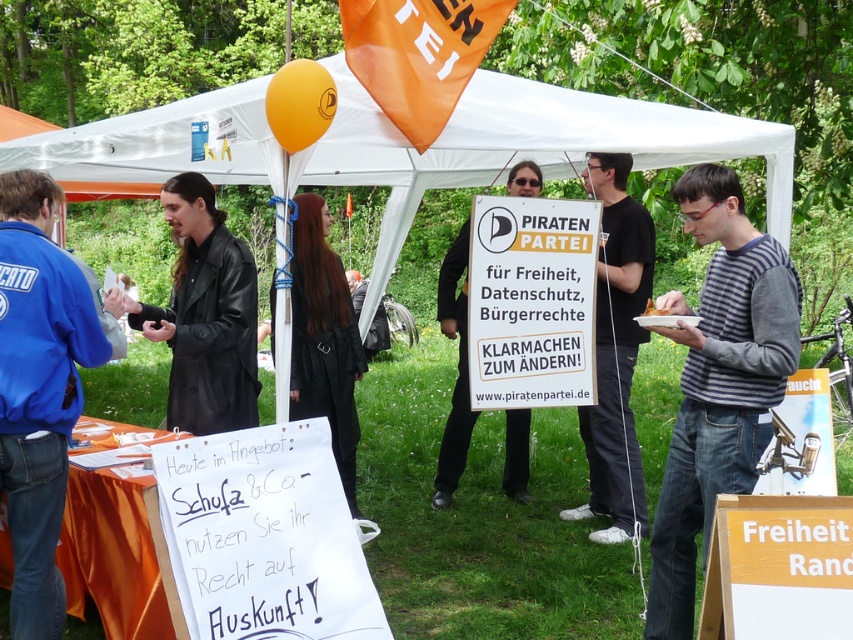
What is the spatial relationship between the white paper sign at lower left and the black matte sign at center?

The white paper sign at lower left is to the left of the black matte sign at center.

You are standing at the entrance of the tent and want to determine which of the two points, point (x=300, y=540) or point (x=508, y=208), is closer to you. Based on the spatial arrangement, which point is nearer?

Point (x=300, y=540) is closer to the viewer than point (x=508, y=208), so the point nearer to you is point (x=300, y=540).